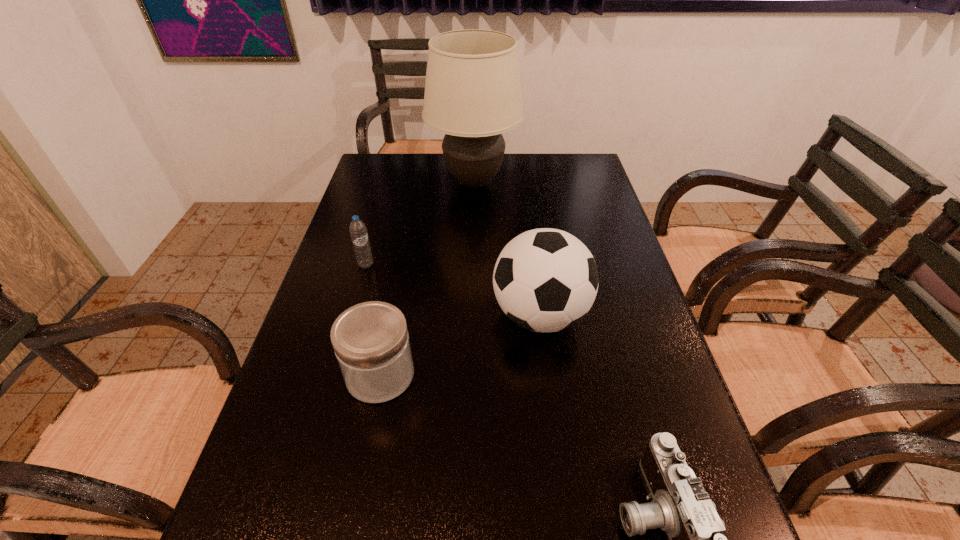
I want to click on object located at the far edge, so click(x=473, y=94).

The height and width of the screenshot is (540, 960). Identify the location of water bottle that is at the left edge. (x=358, y=231).

Identify the location of jar located in the left edge section of the desktop. This screenshot has width=960, height=540. (371, 342).

Locate an element on the screen. object positioned at the right edge is located at coordinates (545, 280).

At what (x,y) coordinates should I click in order to perform the action: click on blank space at the far edge. Please return your answer as a coordinate pair (x, y). This screenshot has height=540, width=960. Looking at the image, I should click on (550, 172).

Find the location of a particular element. blank space at the left edge is located at coordinates (300, 388).

At what (x,y) coordinates should I click in order to perform the action: click on free space at the right edge. Please return your answer as a coordinate pair (x, y). The height and width of the screenshot is (540, 960). Looking at the image, I should click on point(631,278).

In the image, there is a desktop. At what (x,y) coordinates should I click in order to perform the action: click on vacant space at the far left corner. Please return your answer as a coordinate pair (x, y). The height and width of the screenshot is (540, 960). Looking at the image, I should click on (366, 178).

In the image, there is a desktop. Where is `vacant space at the far right corner`? The height and width of the screenshot is (540, 960). vacant space at the far right corner is located at coordinates (588, 164).

Locate an element on the screen. This screenshot has height=540, width=960. unoccupied position between the fourth shortest object and the second farthest object is located at coordinates (453, 290).